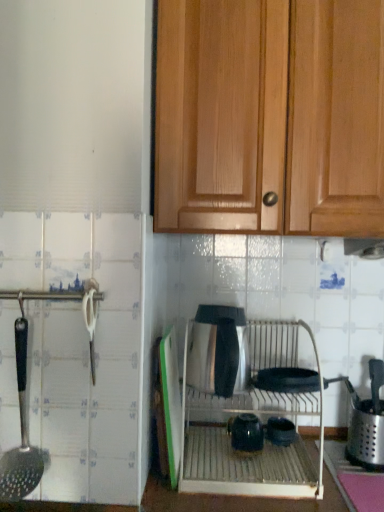
Question: Is satin silver oven at center situated inside black plastic slotted spoon at left or outside?

Choices:
 (A) inside
 (B) outside

Answer: (B)

Question: From their relative heights in the image, would you say satin silver oven at center is taller or shorter than black plastic slotted spoon at left?

Choices:
 (A) tall
 (B) short

Answer: (B)

Question: Which object is the closest to the satin silver kettle at center, the 3th appliance when ordered from right to left?

Choices:
 (A) satin silver oven at center
 (B) stainless steel utensil holder at right, the first appliance from the right
 (C) wooden cabinet at upper center
 (D) matte black kettle at center, which ranks as the 2th appliance in left-to-right order
 (E) black plastic slotted spoon at left

Answer: (A)

Question: Estimate the real-world distances between objects in this image. Which object is farther from the glossy ceramic tea pot at center?

Choices:
 (A) satin silver kettle at center, the 3th appliance when ordered from right to left
 (B) matte black kettle at center, which ranks as the 2th appliance in left-to-right order
 (C) satin silver exhaust hood at upper center
 (D) stainless steel utensil holder at right, the first appliance from the right
 (E) wooden cabinet at upper center

Answer: (E)